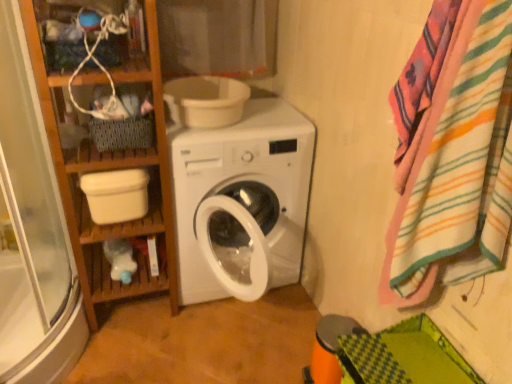
What are the coordinates of `wooden bookshelf at left` in the screenshot? It's located at (109, 170).

The height and width of the screenshot is (384, 512). I want to click on striped cotton bath towel at right, so click(459, 166).

Identify the location of woven fabric basket at upper left. The width and height of the screenshot is (512, 384). (122, 133).

Describe the element at coordinates (217, 37) in the screenshot. This screenshot has width=512, height=384. I see `cotton curtain at upper center` at that location.

I want to click on wooden bookshelf at left, so [x=109, y=170].

From a real-world perspective, relative to wooden bookshelf at left, is striped cotton bath towel at right vertically above or below?

striped cotton bath towel at right is above wooden bookshelf at left.

Does point (481, 121) appear closer or farther from the camera than point (155, 118)?

Point (481, 121) is closer to the camera than point (155, 118).

Is striped cotton bath towel at right oriented away from wooden bookshelf at left?

No, striped cotton bath towel at right is not facing the opposite direction of wooden bookshelf at left.

Does striped cotton bath towel at right have a smaller size compared to wooden bookshelf at left?

Indeed, striped cotton bath towel at right has a smaller size compared to wooden bookshelf at left.

This screenshot has height=384, width=512. What are the coordinates of `basket on the right of wooden bookshelf at left` in the screenshot? It's located at click(122, 133).

Who is taller, wooden bookshelf at left or woven fabric basket at upper left?

wooden bookshelf at left.

In terms of size, does wooden bookshelf at left appear bigger or smaller than woven fabric basket at upper left?

wooden bookshelf at left is bigger than woven fabric basket at upper left.

Would you say wooden bookshelf at left is a long distance from woven fabric basket at upper left?

wooden bookshelf at left is actually quite close to woven fabric basket at upper left.

Between cotton curtain at upper center and striped cotton bath towel at right, which one appears on the right side from the viewer's perspective?

Positioned to the right is striped cotton bath towel at right.

Which is further, (249, 21) or (489, 39)?

The point (249, 21) is behind.

Is cotton curtain at upper center inside the boundaries of striped cotton bath towel at right, or outside?

cotton curtain at upper center is spatially situated outside striped cotton bath towel at right.

Does white plastic bucket at lower left, which is the second toilet bowl from top to bottom, have a larger size compared to wooden shelf at upper left?

No.

In the scene shown: How much distance is there between white plastic bucket at lower left, the second toilet bowl positioned from the right, and wooden shelf at upper left?

43.72 centimeters.

Are white plastic bucket at lower left, the second toilet bowl positioned from the right, and wooden shelf at upper left far apart?

They are positioned close to each other.

How different are the orientations of white plastic bucket at lower left, which is the second toilet bowl from top to bottom, and wooden shelf at upper left in degrees?

0.000325 degrees separate the facing orientations of white plastic bucket at lower left, which is the second toilet bowl from top to bottom, and wooden shelf at upper left.

Which of these two, white plastic bowl at upper center, the 2th toilet bowl when ordered from left to right, or striped cotton bath towel at right, stands shorter?

white plastic bowl at upper center, the 2th toilet bowl when ordered from left to right, is shorter.

Can you confirm if white plastic bowl at upper center, the first toilet bowl from the right, is bigger than striped cotton bath towel at right?

Yes, white plastic bowl at upper center, the first toilet bowl from the right, is bigger than striped cotton bath towel at right.

Locate an element on the screen. basket below the wooden shelf at upper left (from a real-world perspective) is located at coordinates pyautogui.click(x=122, y=133).

Is point (92, 44) closer or farther from the camera than point (131, 140)?

Point (92, 44) is closer to the camera than point (131, 140).

Relative to woven fabric basket at upper left, is wooden shelf at upper left in front or behind?

In the image, wooden shelf at upper left appears in front of woven fabric basket at upper left.

Is wooden shelf at upper left facing away from woven fabric basket at upper left?

No, woven fabric basket at upper left is not at the back of wooden shelf at upper left.

Is white plastic bucket at lower left, arranged as the first toilet bowl when ordered from the bottom, spatially inside white plastic bowl at upper center, the first toilet bowl from the right, or outside of it?

white plastic bucket at lower left, arranged as the first toilet bowl when ordered from the bottom, exists outside the volume of white plastic bowl at upper center, the first toilet bowl from the right.

From their relative heights in the image, would you say white plastic bucket at lower left, arranged as the first toilet bowl when ordered from the bottom, is taller or shorter than white plastic bowl at upper center, the 2th toilet bowl when ordered from left to right?

In the image, white plastic bucket at lower left, arranged as the first toilet bowl when ordered from the bottom, appears to be taller than white plastic bowl at upper center, the 2th toilet bowl when ordered from left to right.

Measure the distance between white plastic bucket at lower left, which is the second toilet bowl from top to bottom, and white plastic bowl at upper center, the first toilet bowl from the right.

A distance of 15.81 inches exists between white plastic bucket at lower left, which is the second toilet bowl from top to bottom, and white plastic bowl at upper center, the first toilet bowl from the right.

Relative to white plastic bowl at upper center, which appears as the second toilet bowl when ordered from the bottom, is white plastic bucket at lower left, which is the 1th toilet bowl in left-to-right order, in front or behind?

Visually, white plastic bucket at lower left, which is the 1th toilet bowl in left-to-right order, is located in front of white plastic bowl at upper center, which appears as the second toilet bowl when ordered from the bottom.

Find the location of a particular element. bath towel above the wooden bookshelf at left (from the image's perspective) is located at coordinates (459, 166).

Find the location of a particular element. The width and height of the screenshot is (512, 384). bookshelf in front of the woven fabric basket at upper left is located at coordinates (109, 170).

Estimate the real-world distances between objects in this image. Which object is closer to cotton curtain at upper center, wooden bookshelf at left or wooden shelf at upper left?

Among the two, wooden shelf at upper left is located nearer to cotton curtain at upper center.

From the image, which object appears to be nearer to woven fabric basket at upper left, wooden shelf at upper left or cotton curtain at upper center?

wooden shelf at upper left.

Estimate the real-world distances between objects in this image. Which object is further from woven fabric basket at upper left, striped cotton bath towel at right or wooden shelf at upper left?

Based on the image, striped cotton bath towel at right appears to be further to woven fabric basket at upper left.

Considering their positions, is wooden shelf at upper left positioned further to white plastic bucket at lower left, which is the second toilet bowl from top to bottom, than wooden bookshelf at left?

Among the two, wooden shelf at upper left is located further to white plastic bucket at lower left, which is the second toilet bowl from top to bottom.

From the image, which object appears to be farther from wooden shelf at upper left, white plastic bowl at upper center, which appears as the second toilet bowl when ordered from the bottom, or woven fabric basket at upper left?

Among the two, white plastic bowl at upper center, which appears as the second toilet bowl when ordered from the bottom, is located further to wooden shelf at upper left.

Considering their positions, is white plastic bowl at upper center, which appears as the second toilet bowl when ordered from the bottom, positioned further to woven fabric basket at upper left than wooden bookshelf at left?

Based on the image, white plastic bowl at upper center, which appears as the second toilet bowl when ordered from the bottom, appears to be further to woven fabric basket at upper left.

Considering their positions, is wooden shelf at upper left positioned closer to wooden bookshelf at left than striped cotton bath towel at right?

wooden shelf at upper left lies closer to wooden bookshelf at left than the other object.

Which object lies nearer to the anchor point white plastic bucket at lower left, which is the 1th toilet bowl in left-to-right order, woven fabric basket at upper left or striped cotton bath towel at right?

woven fabric basket at upper left is positioned closer to the anchor white plastic bucket at lower left, which is the 1th toilet bowl in left-to-right order.

Where is `toilet bowl between white plastic bucket at lower left, the second toilet bowl positioned from the right, and striped cotton bath towel at right, in the horizontal direction`? toilet bowl between white plastic bucket at lower left, the second toilet bowl positioned from the right, and striped cotton bath towel at right, in the horizontal direction is located at coordinates (208, 100).

Find the location of a particular element. The image size is (512, 384). curtain between white plastic bucket at lower left, the second toilet bowl positioned from the right, and striped cotton bath towel at right, in the horizontal direction is located at coordinates (217, 37).

Where is `curtain between wooden bookshelf at left and striped cotton bath towel at right`? curtain between wooden bookshelf at left and striped cotton bath towel at right is located at coordinates (217, 37).

Where is `basket located between white plastic bucket at lower left, which is the 1th toilet bowl in left-to-right order, and striped cotton bath towel at right in the left-right direction`? basket located between white plastic bucket at lower left, which is the 1th toilet bowl in left-to-right order, and striped cotton bath towel at right in the left-right direction is located at coordinates (122, 133).